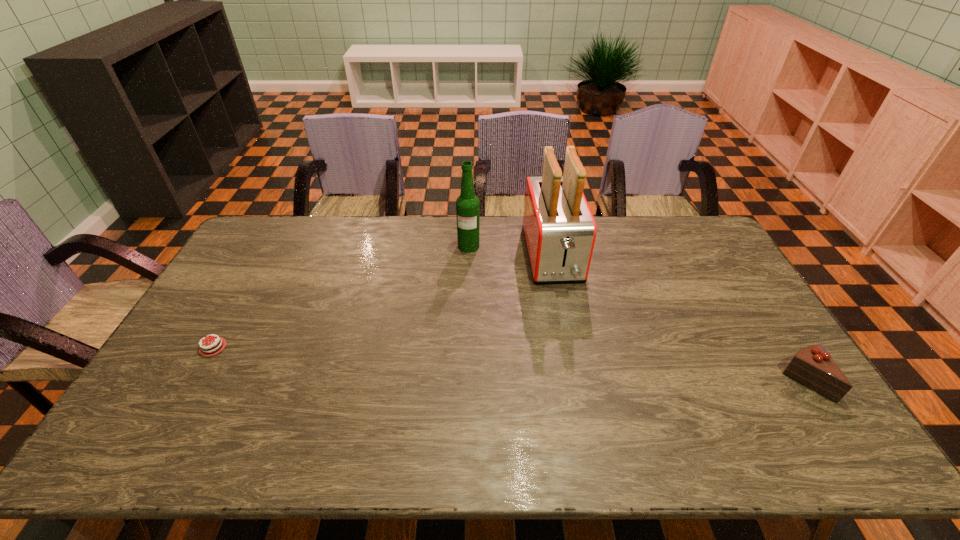
Locate an element on the screen. free space between the right chocolate cake and the left chocolate cake is located at coordinates (509, 364).

Locate an element on the screen. vacant space that is in between the third object from right to left and the right chocolate cake is located at coordinates (636, 314).

Locate an element on the screen. This screenshot has width=960, height=540. vacant space that's between the third tallest object and the left chocolate cake is located at coordinates (509, 364).

Where is `free area in between the beer bottle and the shorter chocolate cake`? This screenshot has height=540, width=960. free area in between the beer bottle and the shorter chocolate cake is located at coordinates pyautogui.click(x=341, y=297).

This screenshot has height=540, width=960. Find the location of `empty space between the rightmost object and the second object from right to left`. empty space between the rightmost object and the second object from right to left is located at coordinates (679, 319).

Image resolution: width=960 pixels, height=540 pixels. Identify the location of object identified as the third closest to the taller chocolate cake. (215, 345).

Identify the location of the closest object to the shorter chocolate cake. (467, 204).

The width and height of the screenshot is (960, 540). In order to click on free space that satisfies the following two spatial constraints: 1. on the back side of the beer bottle; 2. on the left side of the left chocolate cake in this screenshot , I will do `click(271, 246)`.

Find the location of a particular element. free space that satisfies the following two spatial constraints: 1. on the back side of the left chocolate cake; 2. on the left side of the third object from left to right is located at coordinates click(x=265, y=255).

The height and width of the screenshot is (540, 960). I want to click on vacant space that satisfies the following two spatial constraints: 1. on the front side of the third object from left to right; 2. on the left side of the right chocolate cake, so click(577, 382).